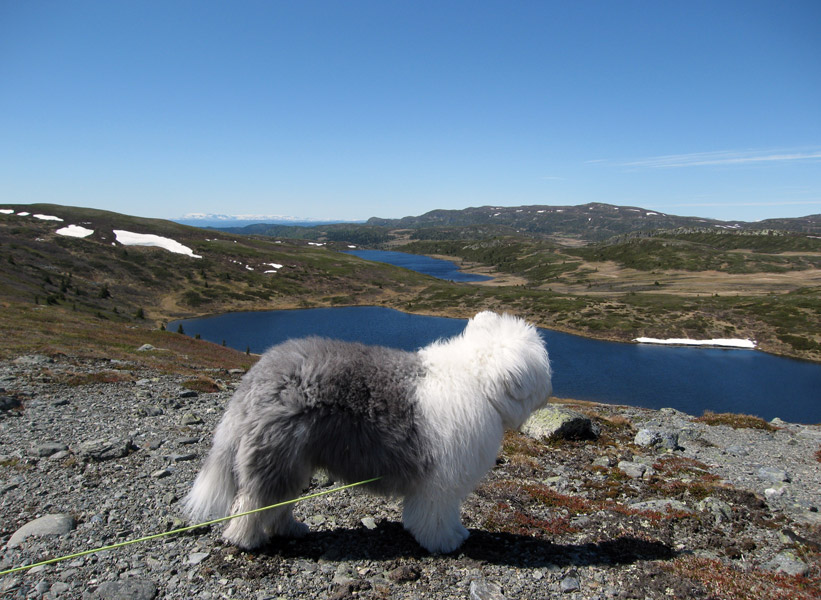
Locate an element on the screen. Image resolution: width=821 pixels, height=600 pixels. white fur is located at coordinates (475, 386).